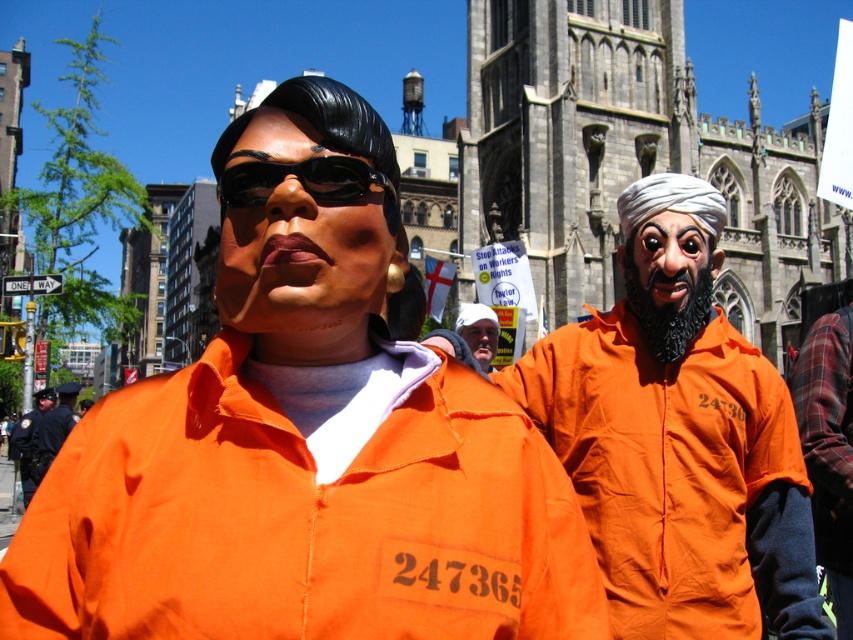
Question: Does matte black mask at center have a lesser width compared to white cap at center?

Choices:
 (A) no
 (B) yes

Answer: (A)

Question: Is orange matte jumpsuit at center to the left of smooth orange mask at center from the viewer's perspective?

Choices:
 (A) yes
 (B) no

Answer: (A)

Question: Is orange matte/jersey at center closer to the viewer compared to smooth orange mask at center?

Choices:
 (A) yes
 (B) no

Answer: (A)

Question: Which object is the closest to the smooth orange mask at center?

Choices:
 (A) black plastic goggles at center
 (B) matte black mask at center

Answer: (A)

Question: Which is nearer to the orange matte jumpsuit at center?

Choices:
 (A) orange prison jumpsuit at center
 (B) white cap at center

Answer: (B)

Question: Which point appears closest to the camera in this image?

Choices:
 (A) (646, 195)
 (B) (51, 419)
 (C) (474, 346)

Answer: (A)